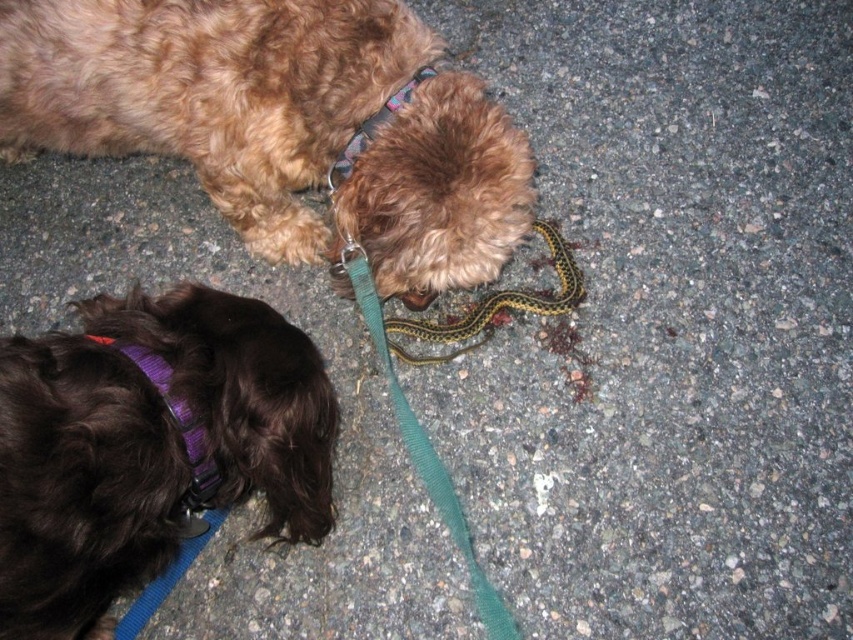
Question: Is brown curly fur dog at upper center in front of purple fabric neckband at lower left?

Choices:
 (A) yes
 (B) no

Answer: (B)

Question: Can you confirm if purple fabric neckband at lower left is thinner than purple fabric neckband at upper center?

Choices:
 (A) yes
 (B) no

Answer: (A)

Question: Which object is farther from the camera taking this photo?

Choices:
 (A) green nylon leash at center
 (B) yellow-green striped snake at center

Answer: (B)

Question: Which of these objects is positioned closest to the green nylon leash at center?

Choices:
 (A) purple fabric neckband at upper center
 (B) black fuzzy dog at lower left
 (C) purple fabric neckband at lower left
 (D) brown curly fur dog at upper center

Answer: (D)

Question: Considering the relative positions of yellow-green striped snake at center and purple fabric neckband at upper center in the image provided, where is yellow-green striped snake at center located with respect to purple fabric neckband at upper center?

Choices:
 (A) below
 (B) above

Answer: (A)

Question: Which object appears farthest from the camera in this image?

Choices:
 (A) green nylon leash at center
 (B) purple fabric neckband at upper center
 (C) yellow-green striped snake at center

Answer: (C)